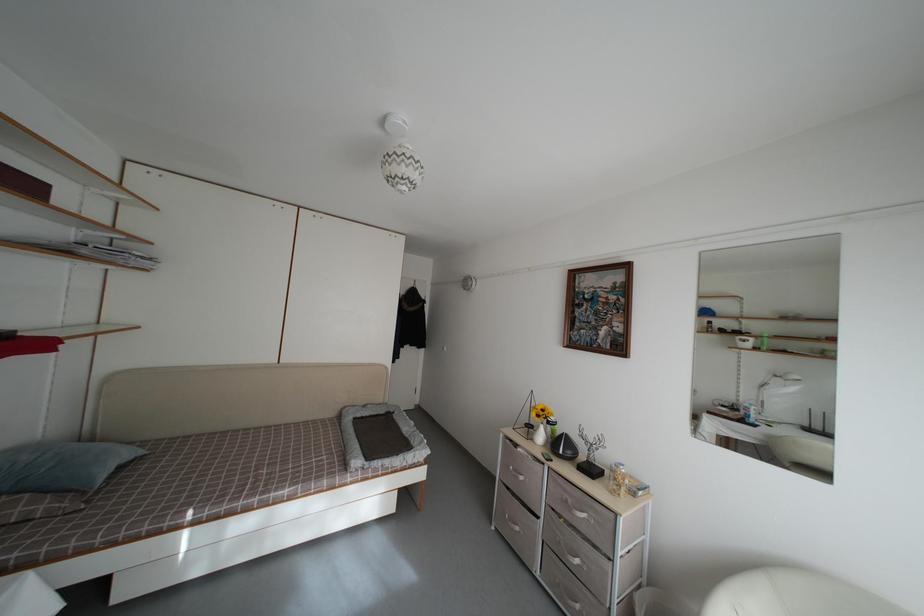
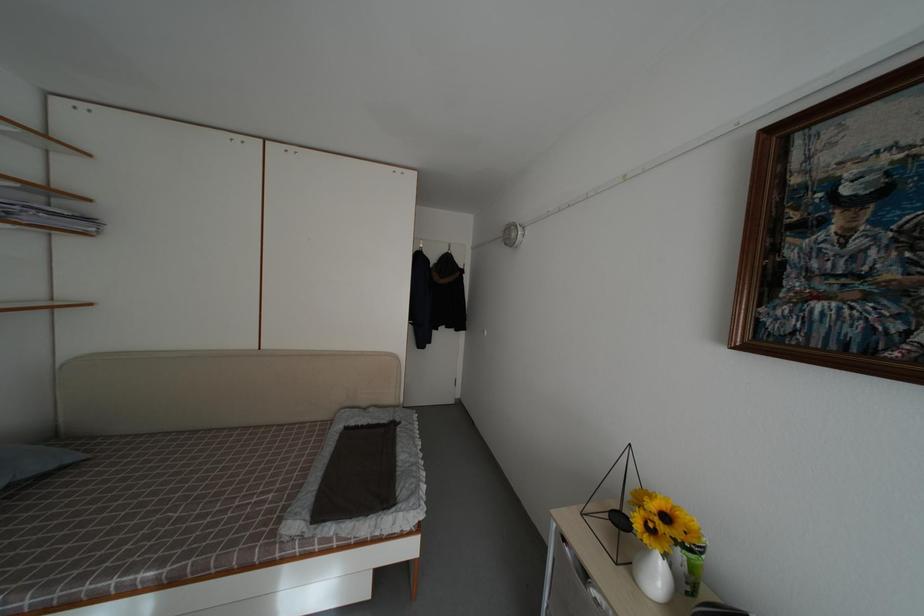
The point at (x=148, y=458) is marked in the first image. Where is the corresponding point in the second image?

(80, 464)